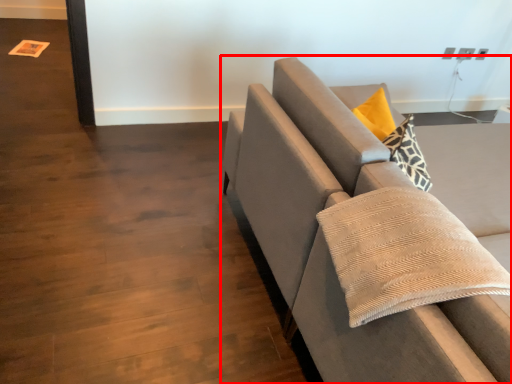
Question: From the image's perspective, where is studio couch (annotated by the red box) located in relation to pillow in the image?

Choices:
 (A) above
 (B) below

Answer: (A)